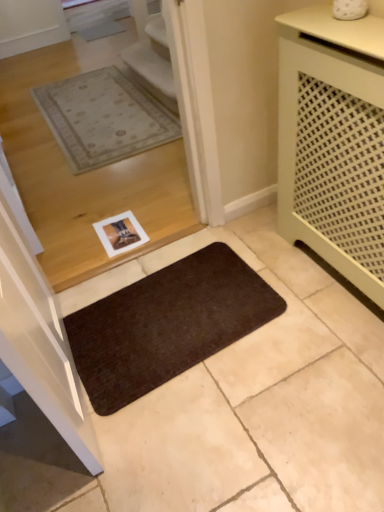
I want to click on brown matte mat at lower center, so click(x=166, y=324).

Image resolution: width=384 pixels, height=512 pixels. What do you see at coordinates (166, 324) in the screenshot? I see `brown matte mat at lower center` at bounding box center [166, 324].

What is the approximate height of brown matte mat at lower center?

brown matte mat at lower center is 1.13 inches tall.

The height and width of the screenshot is (512, 384). I want to click on matte green cabinet at right, so click(x=333, y=141).

Describe the element at coordinates (333, 141) in the screenshot. I see `matte green cabinet at right` at that location.

The height and width of the screenshot is (512, 384). I want to click on brown matte mat at lower center, so click(x=166, y=324).

Based on the photo, considering the positions of objects matte green cabinet at right and brown matte mat at lower center in the image provided, who is more to the right, matte green cabinet at right or brown matte mat at lower center?

Positioned to the right is matte green cabinet at right.

Is matte green cabinet at right positioned behind brown matte mat at lower center?

No.

Considering the positions of points (315, 64) and (247, 265), is point (315, 64) farther from camera compared to point (247, 265)?

No, it is not.

From the image's perspective, is matte green cabinet at right positioned above or below brown matte mat at lower center?

matte green cabinet at right is above brown matte mat at lower center.

From a real-world perspective, is matte green cabinet at right below brown matte mat at lower center?

No, from a real-world perspective, matte green cabinet at right is not below brown matte mat at lower center.

Considering the relative sizes of matte green cabinet at right and brown matte mat at lower center in the image provided, is matte green cabinet at right wider than brown matte mat at lower center?

No.

From their relative heights in the image, would you say matte green cabinet at right is taller or shorter than brown matte mat at lower center?

matte green cabinet at right is taller than brown matte mat at lower center.

Based on their sizes in the image, would you say matte green cabinet at right is bigger or smaller than brown matte mat at lower center?

Considering their sizes, matte green cabinet at right takes up more space than brown matte mat at lower center.

Could brown matte mat at lower center be considered to be inside matte green cabinet at right?

No, brown matte mat at lower center is not inside matte green cabinet at right.

Is matte green cabinet at right not near brown matte mat at lower center?

matte green cabinet at right is actually quite close to brown matte mat at lower center.

Looking at this image, could you tell me if matte green cabinet at right is turned towards brown matte mat at lower center?

Yes, matte green cabinet at right is facing brown matte mat at lower center.

This screenshot has width=384, height=512. Identify the location of mat behind the matte green cabinet at right. (166, 324).

Looking at this image, can you confirm if brown matte mat at lower center is positioned to the right of matte green cabinet at right?

No, brown matte mat at lower center is not to the right of matte green cabinet at right.

Who is more distant, brown matte mat at lower center or matte green cabinet at right?

brown matte mat at lower center.

Is point (184, 329) positioned in front of point (315, 77)?

No.

From the image's perspective, which one is positioned lower, brown matte mat at lower center or matte green cabinet at right?

brown matte mat at lower center is shown below in the image.

From a real-world perspective, is brown matte mat at lower center beneath matte green cabinet at right?

Yes, from a real-world perspective, brown matte mat at lower center is below matte green cabinet at right.

Is brown matte mat at lower center wider or thinner than matte green cabinet at right?

brown matte mat at lower center is wider than matte green cabinet at right.

From the picture: Is brown matte mat at lower center taller than matte green cabinet at right?

No.

Can you confirm if brown matte mat at lower center is bigger than matte green cabinet at right?

Actually, brown matte mat at lower center might be smaller than matte green cabinet at right.

Which is correct: brown matte mat at lower center is inside matte green cabinet at right, or outside of it?

brown matte mat at lower center is not enclosed by matte green cabinet at right.

Is brown matte mat at lower center touching matte green cabinet at right?

No, brown matte mat at lower center is not making contact with matte green cabinet at right.

Is brown matte mat at lower center aimed at matte green cabinet at right?

No, brown matte mat at lower center is not oriented towards matte green cabinet at right.

How many degrees apart are the facing directions of brown matte mat at lower center and matte green cabinet at right?

They differ by 92.4 degrees in their facing directions.

The width and height of the screenshot is (384, 512). Find the location of `cabinetry above the brown matte mat at lower center (from a real-world perspective)`. cabinetry above the brown matte mat at lower center (from a real-world perspective) is located at coordinates (333, 141).

The width and height of the screenshot is (384, 512). What are the coordinates of `cabinetry that appears above the brown matte mat at lower center (from the image's perspective)` in the screenshot? It's located at (333, 141).

There is a brown matte mat at lower center. At what (x,y) coordinates should I click in order to perform the action: click on cabinetry above it (from a real-world perspective). Please return your answer as a coordinate pair (x, y). Looking at the image, I should click on (333, 141).